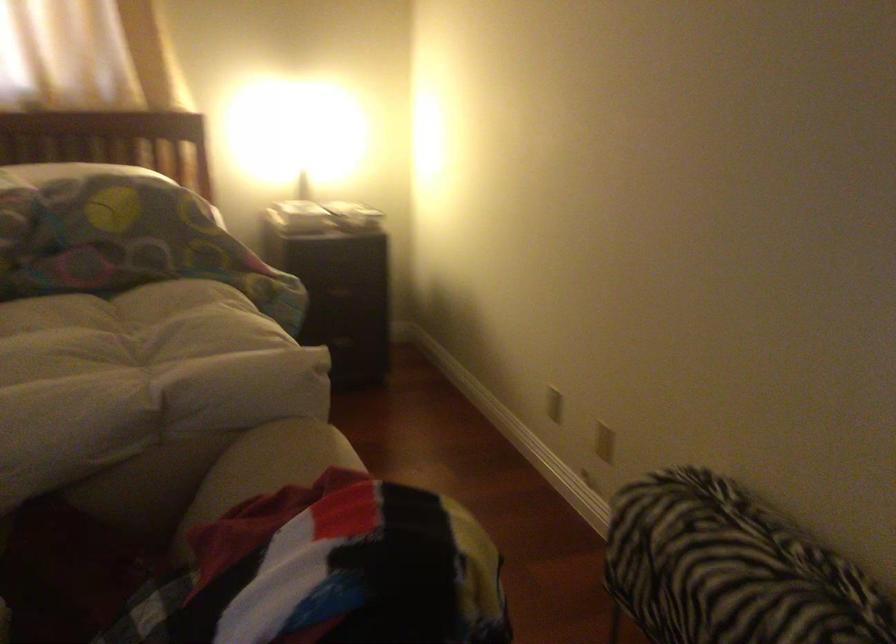
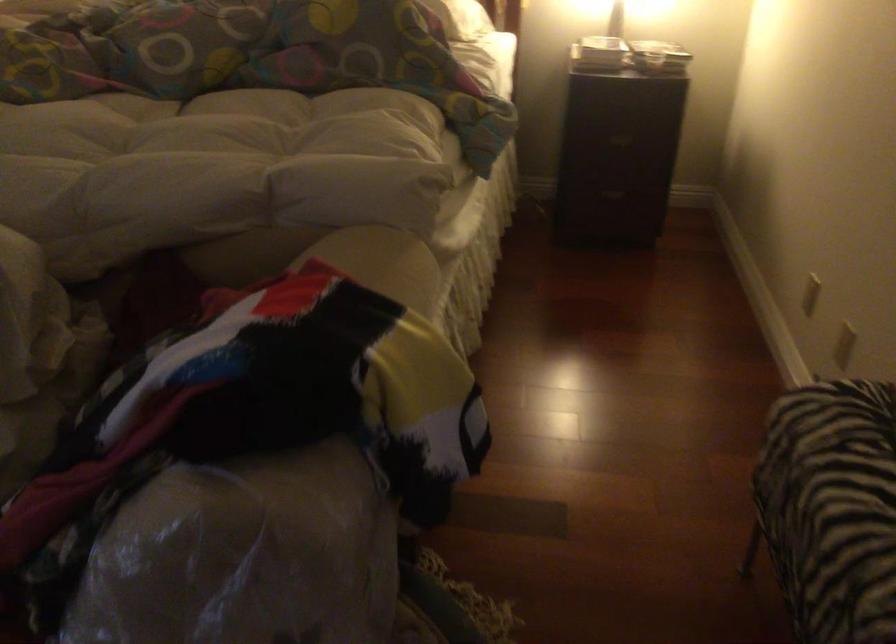
The point at [707,576] is marked in the first image. Where is the corresponding point in the second image?

(831, 507)